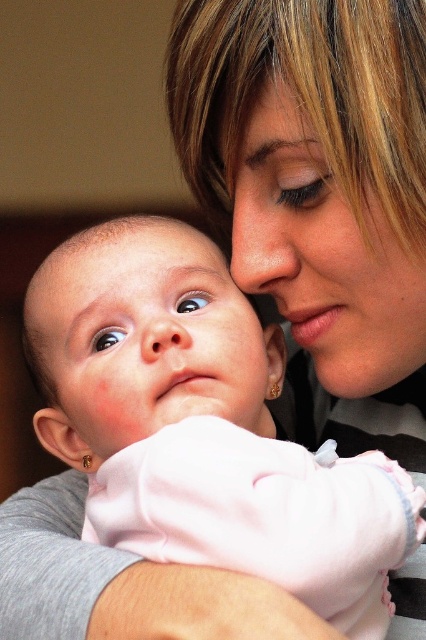
Which is more to the left, pink fabric baby at center or pink fabric at center?

Positioned to the left is pink fabric at center.

Describe the element at coordinates (143, 340) in the screenshot. I see `pink fabric baby at center` at that location.

Locate an element on the screen. This screenshot has width=426, height=640. pink fabric baby at center is located at coordinates click(143, 340).